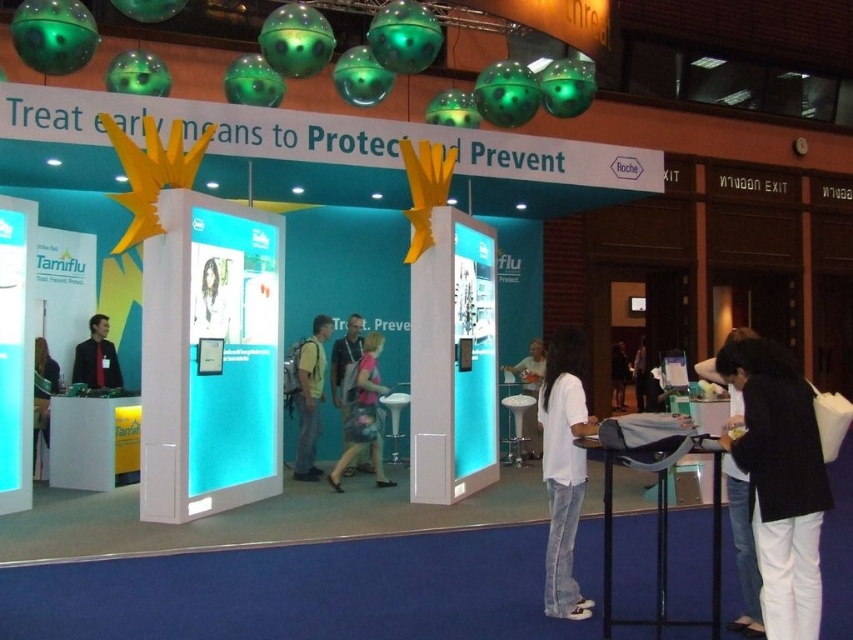
Question: Can you confirm if denim jacket at center is thinner than matte black suit at left?

Choices:
 (A) yes
 (B) no

Answer: (A)

Question: Is light blue fabric backpack at center below white glossy poster at center?

Choices:
 (A) yes
 (B) no

Answer: (A)

Question: Based on their relative distances, which object is farther from the matte black suit at left?

Choices:
 (A) floral fabric dress at center
 (B) matte white shirt at center
 (C) white fabric at center
 (D) black fabric at center

Answer: (D)

Question: Which object is the closest to the white matte pants at lower right?

Choices:
 (A) floral fabric dress at center
 (B) matte black suit at left
 (C) matte white shirt at center
 (D) matte black jacket at center

Answer: (A)

Question: Can you confirm if denim jacket at center is bigger than white fabric at center?

Choices:
 (A) yes
 (B) no

Answer: (B)

Question: Which object is the farthest from the white matte shirt at lower right?

Choices:
 (A) denim jacket at center
 (B) light blue fabric backpack at center
 (C) white fabric at center
 (D) white cotton shirt at center

Answer: (C)